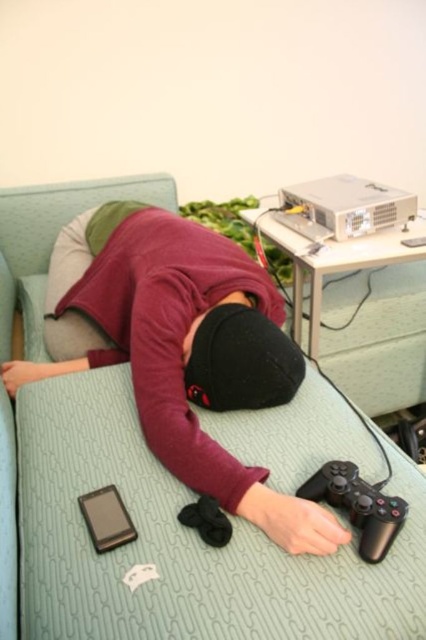
Question: Is green fabric bed at center above black matte game controller at lower right?

Choices:
 (A) no
 (B) yes

Answer: (B)

Question: Which object appears closest to the camera in this image?

Choices:
 (A) black matte smartphone at lower left
 (B) black matte game controller at lower right
 (C) green fabric bed at center

Answer: (C)

Question: Is green fabric bed at center positioned at the back of black matte smartphone at lower left?

Choices:
 (A) no
 (B) yes

Answer: (A)

Question: Which point is closer to the camera?

Choices:
 (A) black matte game controller at lower right
 (B) black matte smartphone at lower left

Answer: (A)

Question: Which point is closer to the camera taking this photo?

Choices:
 (A) (108, 612)
 (B) (101, 525)

Answer: (A)

Question: Is green fabric bed at center bigger than black matte smartphone at lower left?

Choices:
 (A) no
 (B) yes

Answer: (B)